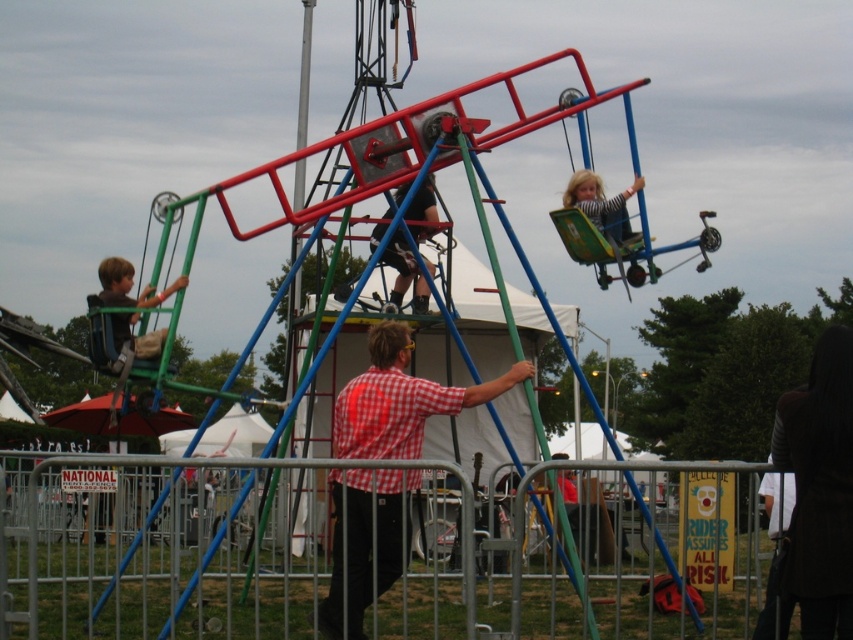
You are a photographer trying to capture both the matte black pants at center and the matte green swing at left in a single frame. Given their sizes, which object will appear more prominent in the photo?

The matte black pants at center will appear more prominent in the photo because it is larger in size than the matte green swing at left.

You are a visitor at the carnival and want to take a photo of both the dark brown leather jacket at lower right and the matte green swing at left in the same frame. Given that your camera has a maximum focal length that allows capturing objects up to 25 meters apart in the same shot, will you be able to include both in the photo?

The dark brown leather jacket at lower right and the matte green swing at left are 24.54 meters apart from each other. Since 24.54 meters is less than the camera maximum focal length of 25 meters, you can include both in the same photo.